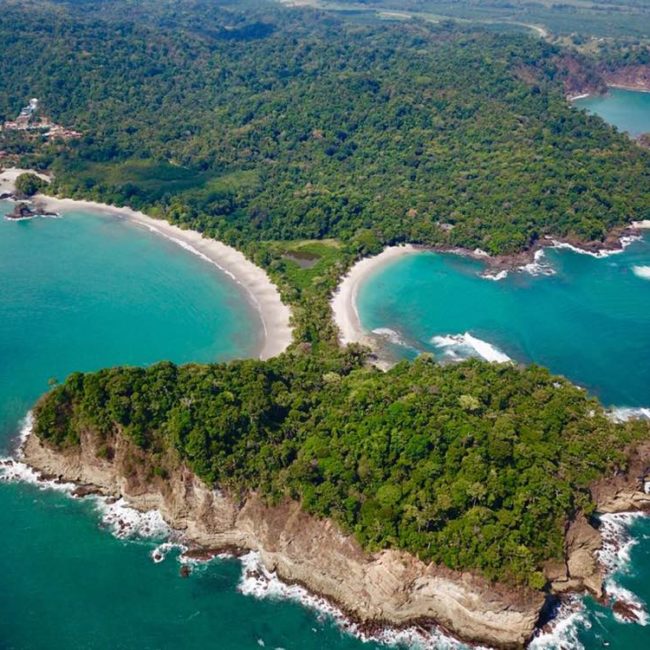
Find the location of a particular element. side of island is located at coordinates (296, 540), (586, 540).